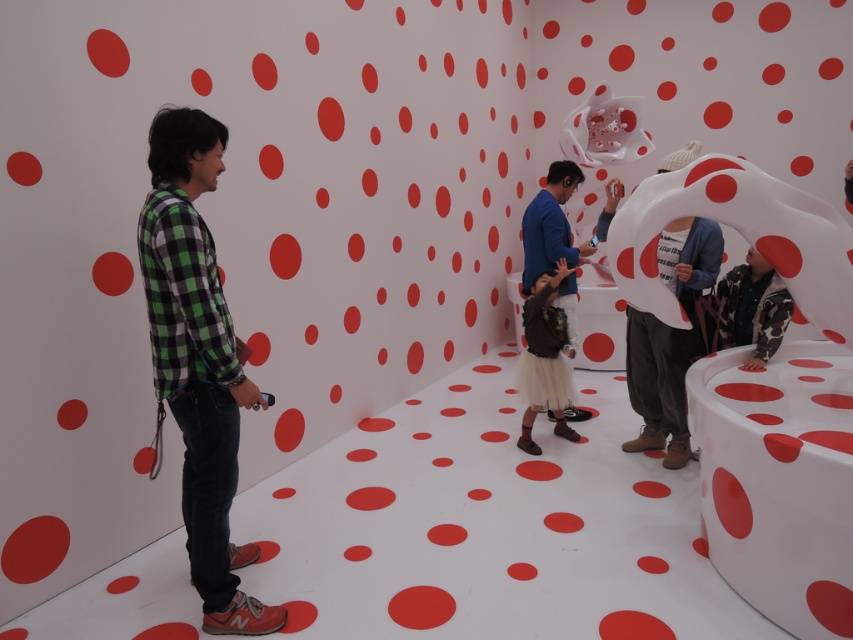
You are an interior designer who wants to place a new chair between the white matte sculpture at center and the brown leather jacket at center. Which object should the chair be closer to if it needs to be positioned closer to the smaller object?

The brown leather jacket at center is smaller than the white matte sculpture at center. Therefore, the chair should be placed closer to the brown leather jacket at center to be near the smaller object.

You are an interior designer planning to place a new piece of furniture in the center of this room. The white matte sculpture at center and the brown leather jacket at center are currently occupying the space. Which object should you move to make room for the furniture, considering their sizes?

The white matte sculpture at center has a smaller width than the brown leather jacket at center, so it would be more practical to move the white matte sculpture at center to accommodate the new furniture.

You are standing in the room and want to take a photo of the white matte sculpture at center without including the green checkered shirt at left in the frame. Based on their positions, is this possible?

The green checkered shirt at left is below the white matte sculpture at center, so if you position yourself to aim the camera upwards towards the sculpture, you can exclude the shirt from the frame.